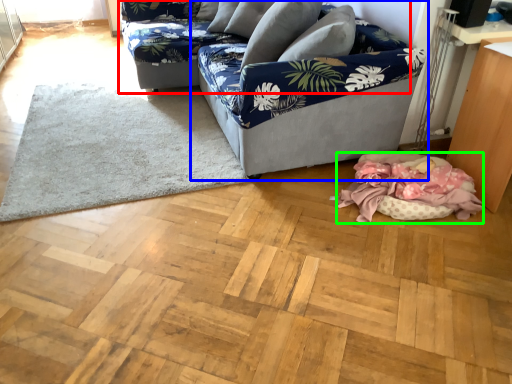
Question: Which is nearer to the studio couch (highlighted by a red box)? studio couch (highlighted by a blue box) or blanket (highlighted by a green box).

Choices:
 (A) studio couch
 (B) blanket

Answer: (A)